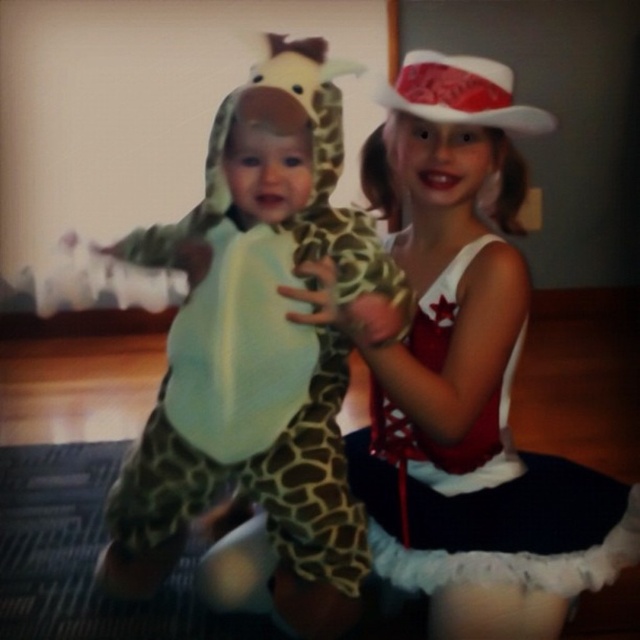
Between matte white dress at center and white felt cowboy hat at upper center, which one has more height?

A: matte white dress at center is taller.

Can you confirm if matte white dress at center is smaller than white felt cowboy hat at upper center?

Incorrect, matte white dress at center is not smaller in size than white felt cowboy hat at upper center.

This screenshot has width=640, height=640. I want to click on matte white dress at center, so click(x=464, y=374).

Is spotted fabric giraffe at left wider than white felt cowboy hat at upper center?

Yes, spotted fabric giraffe at left is wider than white felt cowboy hat at upper center.

Is point (288, 163) behind point (493, 116)?

That is False.

You are a GUI agent. You are given a task and a screenshot of the screen. Output one action in this format:
    pyautogui.click(x=<x>, y=<y>)
    Task: Click on the spotted fabric giraffe at left
    This screenshot has width=640, height=640.
    Given the screenshot: What is the action you would take?
    pyautogui.click(x=257, y=346)

Who is more forward, [433,65] or [316,344]?

Point [433,65]

How distant is matte white dress at center from spotted fabric giraffe at left?

matte white dress at center is 7.57 inches from spotted fabric giraffe at left.

Who is more distant from viewer, (445,472) or (342,497)?

Point (445,472)

Where is `matte white dress at center`? The image size is (640, 640). matte white dress at center is located at coordinates (464, 374).